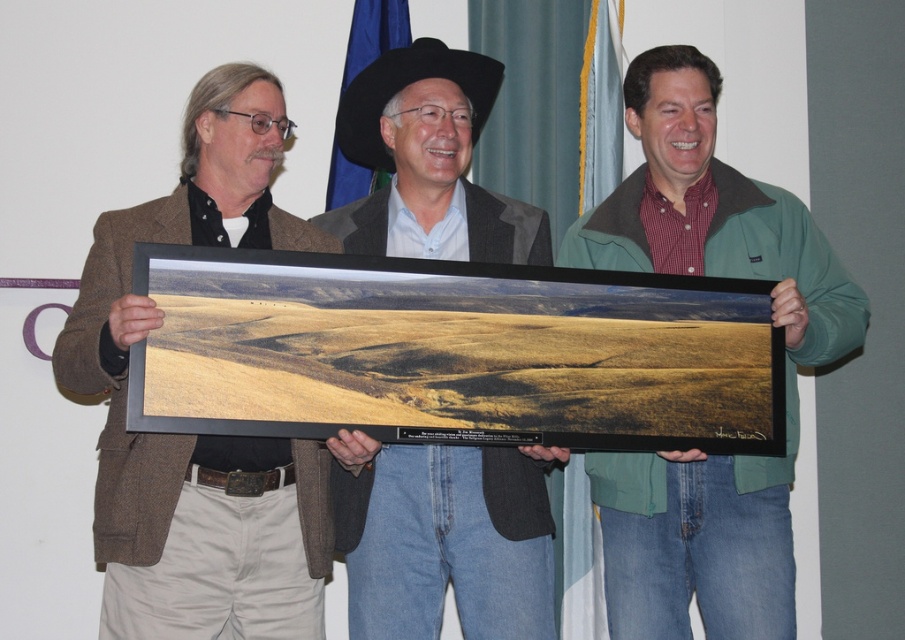
You are a photographer trying to capture a closeup of the man on the right. The two points in the image, point (315,525) and point (687,630), are on his face. Which point should you focus on to get the closest detail?

Point (315,525) is closer to the camera than point (687,630), so you should focus on point (315,525) to get the closest detail.

Based on the scene description, which object is bigger in size between the brown woolen jacket at left and the matte black cowboy hat at center?

The brown woolen jacket at left is larger in size compared to the matte black cowboy hat at center according to the description.